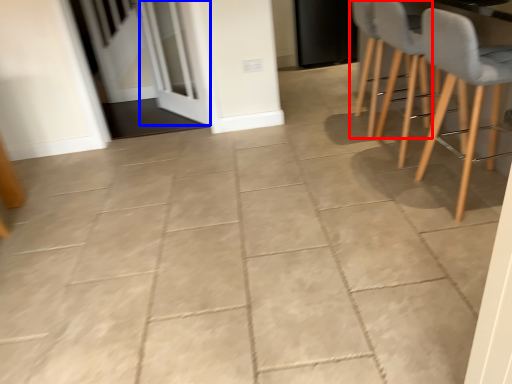
Question: Which object is closer to the camera taking this photo, chair (highlighted by a red box) or screen door (highlighted by a blue box)?

Choices:
 (A) chair
 (B) screen door

Answer: (A)